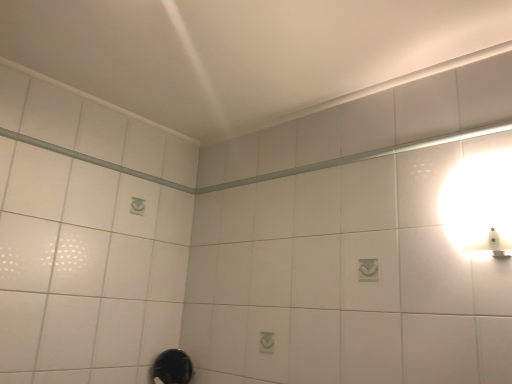
Question: From a real-world perspective, is white glossy wall sconce at upper right physically located above or below black rubber shower at lower center?

Choices:
 (A) below
 (B) above

Answer: (B)

Question: Considering their positions, is white glossy wall sconce at upper right located in front of or behind black rubber shower at lower center?

Choices:
 (A) front
 (B) behind

Answer: (A)

Question: From the image's perspective, relative to black rubber shower at lower center, is white glossy wall sconce at upper right above or below?

Choices:
 (A) below
 (B) above

Answer: (B)

Question: Considering their positions, is black rubber shower at lower center located in front of or behind white glossy wall sconce at upper right?

Choices:
 (A) front
 (B) behind

Answer: (B)

Question: In terms of width, does black rubber shower at lower center look wider or thinner when compared to white glossy wall sconce at upper right?

Choices:
 (A) thin
 (B) wide

Answer: (B)

Question: Based on their sizes in the image, would you say black rubber shower at lower center is bigger or smaller than white glossy wall sconce at upper right?

Choices:
 (A) big
 (B) small

Answer: (A)

Question: Based on their positions, is black rubber shower at lower center located to the left or right of white glossy wall sconce at upper right?

Choices:
 (A) right
 (B) left

Answer: (B)